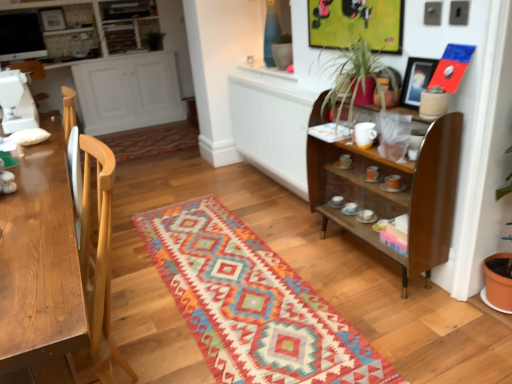
This screenshot has width=512, height=384. I want to click on spots to the right of multicolored woven mat at center, so click(x=358, y=278).